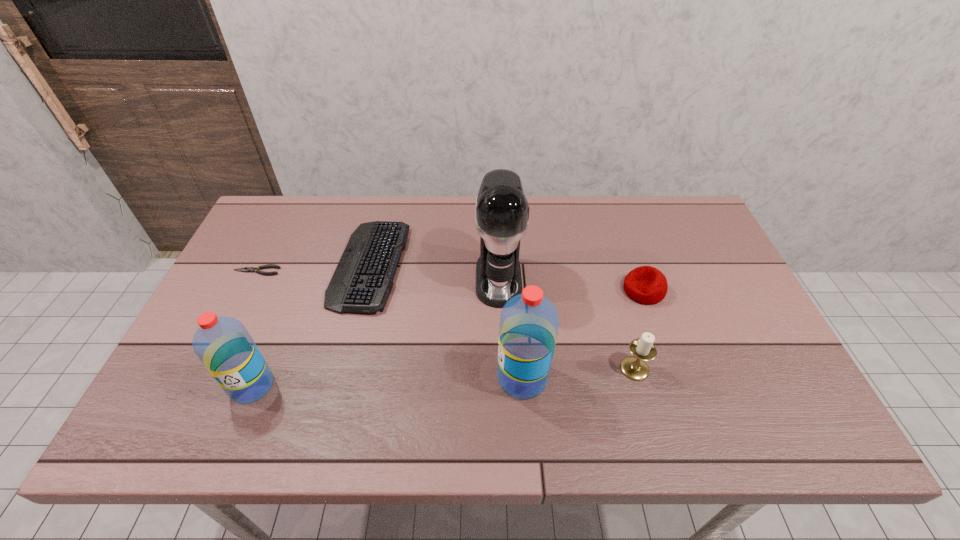
Where is `free location that satisfies the following two spatial constraints: 1. on the seat area of the beanbag; 2. on the front label of the left water bottle`? The image size is (960, 540). free location that satisfies the following two spatial constraints: 1. on the seat area of the beanbag; 2. on the front label of the left water bottle is located at coordinates (677, 386).